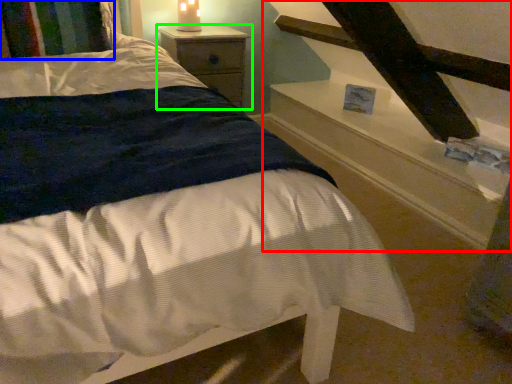
Question: Which is farther away from stairwell (highlighted by a red box)? pillow (highlighted by a blue box) or nightstand (highlighted by a green box)?

Choices:
 (A) pillow
 (B) nightstand

Answer: (A)